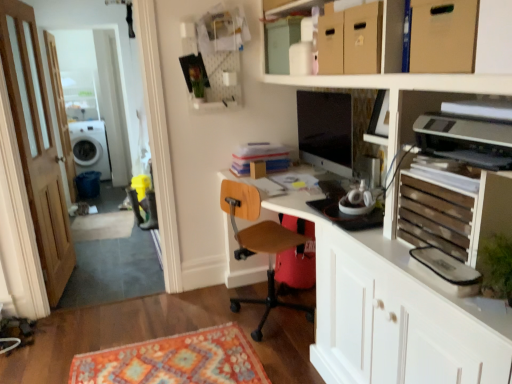
Question: Is cardboard box at upper right facing towards wooden slats at right?

Choices:
 (A) yes
 (B) no

Answer: (B)

Question: Can you confirm if cardboard box at upper right is positioned to the left of wooden slats at right?

Choices:
 (A) no
 (B) yes

Answer: (A)

Question: Is cardboard box at upper right completely or partially outside of wooden slats at right?

Choices:
 (A) no
 (B) yes

Answer: (B)

Question: Does cardboard box at upper right have a greater width compared to wooden slats at right?

Choices:
 (A) yes
 (B) no

Answer: (A)

Question: From a real-world perspective, does cardboard box at upper right sit lower than wooden slats at right?

Choices:
 (A) yes
 (B) no

Answer: (B)

Question: Considering the positions of cardboard box at upper right and wooden door at left in the image, is cardboard box at upper right wider or thinner than wooden door at left?

Choices:
 (A) wide
 (B) thin

Answer: (A)

Question: From a real-world perspective, is cardboard box at upper right positioned above or below wooden door at left?

Choices:
 (A) below
 (B) above

Answer: (B)

Question: In terms of size, does cardboard box at upper right appear bigger or smaller than wooden door at left?

Choices:
 (A) big
 (B) small

Answer: (B)

Question: Is point (x=417, y=67) closer or farther from the camera than point (x=45, y=192)?

Choices:
 (A) farther
 (B) closer

Answer: (B)

Question: Is brown wooden screen door at left inside the boundaries of white glossy entertainment center at upper center, or outside?

Choices:
 (A) outside
 (B) inside

Answer: (A)

Question: Considering the positions of point (67, 142) and point (415, 362), is point (67, 142) closer or farther from the camera than point (415, 362)?

Choices:
 (A) closer
 (B) farther

Answer: (B)

Question: From a real-world perspective, is brown wooden screen door at left above or below white glossy entertainment center at upper center?

Choices:
 (A) above
 (B) below

Answer: (A)

Question: Is brown wooden screen door at left taller or shorter than white glossy entertainment center at upper center?

Choices:
 (A) tall
 (B) short

Answer: (A)

Question: From the image's perspective, relative to brown wooden screen door at left, is wooden slats at right above or below?

Choices:
 (A) above
 (B) below

Answer: (B)

Question: Is wooden slats at right inside or outside of brown wooden screen door at left?

Choices:
 (A) outside
 (B) inside

Answer: (A)